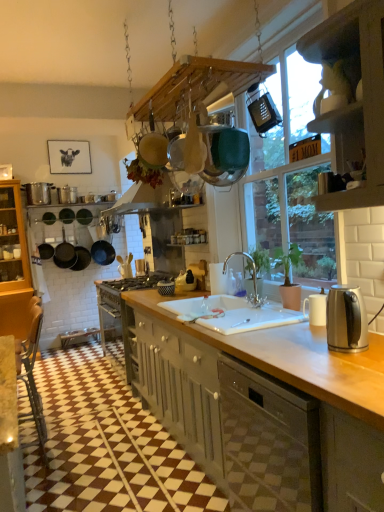
Question: Would you say black paper picture frame at upper left is to the left or to the right of matte gray cabinetry at center, which is the 1th cabinetry from back to front, in the picture?

Choices:
 (A) right
 (B) left

Answer: (B)

Question: From the image's perspective, is black paper picture frame at upper left above or below matte gray cabinetry at center, which appears as the second cabinetry when viewed from the top?

Choices:
 (A) above
 (B) below

Answer: (A)

Question: Which object is the closest to the clear glass faucet at center?

Choices:
 (A) brushed metal toaster at center, arranged as the 2th appliance when viewed from the left
 (B) brushed metal pots at left, the first appliance when ordered from top to bottom
 (C) white ceramic mug at right, the 4th appliance when ordered from left to right
 (D) matte gray cabinetry at center, which is the 1th cabinetry from back to front
 (E) stainless steel kettle at right

Answer: (C)

Question: Which object is the closest to the brushed metal pots at left, which is the fourth appliance in right-to-left order?

Choices:
 (A) brown leather chair at lower left
 (B) black paper picture frame at upper left
 (C) matte gray cabinetry at center, which appears as the second cabinetry when viewed from the top
 (D) white textured window at upper center
 (E) white wood cabinet at upper right, which appears as the 2th cabinetry when ordered from the bottom

Answer: (B)